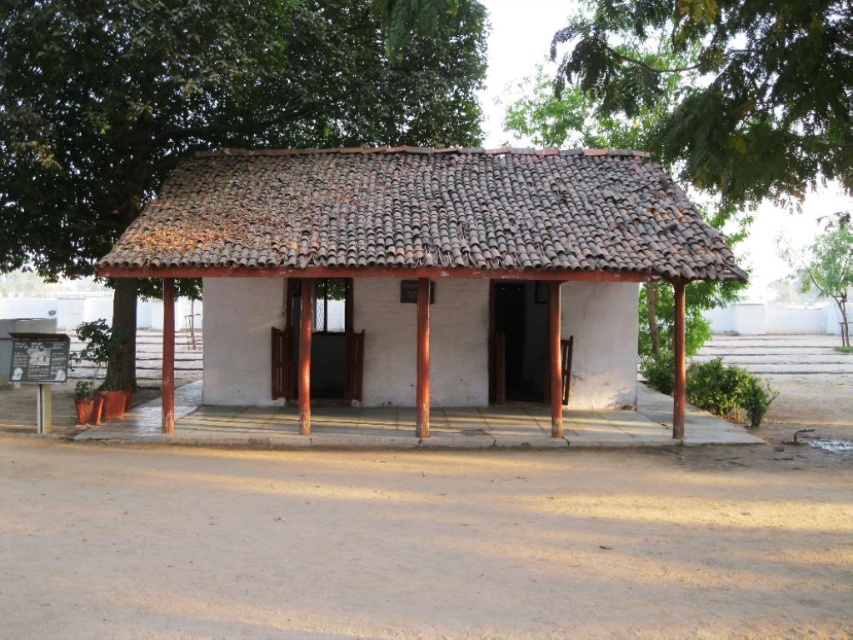
Looking at this image, you are standing at the entrance of the building and want to plant a new tree exactly where the green leafy tree at upper left is currently located. What are the coordinates of the spot where you should plant the new tree?

The coordinates for the green leafy tree at upper left are at point (206, 99), so you should plant the new tree there.

You are a drone operator who needs to fly a drone from the brown tile roof at center to the green leafy tree at upper right. What is the approximate distance you need to cover?

The distance between the brown tile roof at center and the green leafy tree at upper right is approximately 16.32 meters, so the drone needs to cover around 16.3 meters.